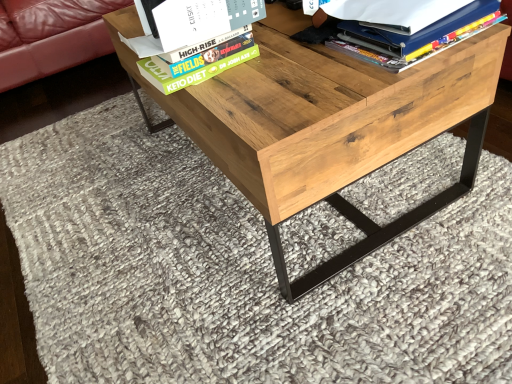
Question: Considering the positions of hardcover book at upper center and matte blue folder at upper right in the image, is hardcover book at upper center wider or thinner than matte blue folder at upper right?

Choices:
 (A) wide
 (B) thin

Answer: (B)

Question: Do you think hardcover book at upper center is within matte blue folder at upper right, or outside of it?

Choices:
 (A) outside
 (B) inside

Answer: (A)

Question: Which is nearer to the natural wood table at center?

Choices:
 (A) matte blue folder at upper right
 (B) hardcover book at upper center

Answer: (A)

Question: Which object is positioned farthest from the natural wood table at center?

Choices:
 (A) hardcover book at upper center
 (B) matte blue folder at upper right

Answer: (A)